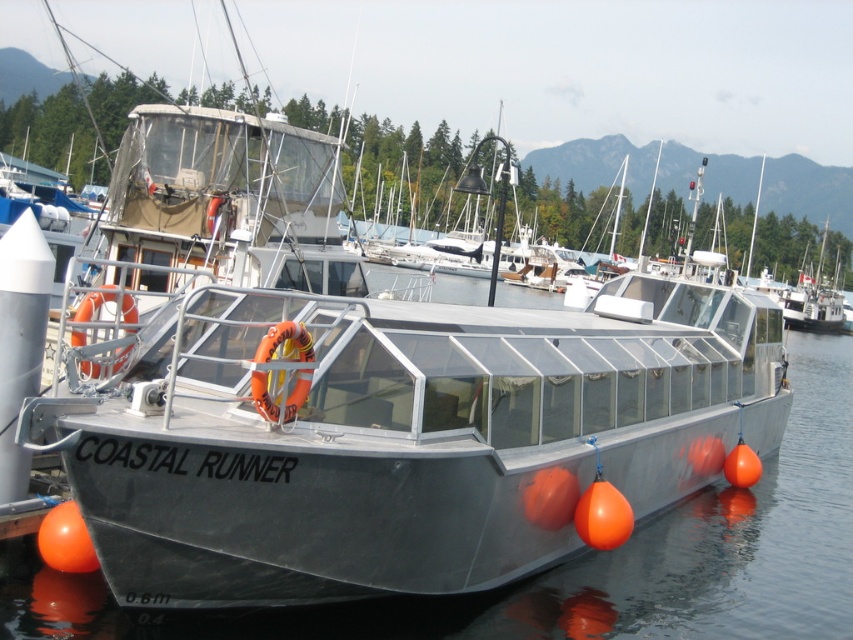
Question: Which point is farther to the camera?

Choices:
 (A) (131, 298)
 (B) (268, 403)

Answer: (A)

Question: Does orange rubber life jacket at center appear on the right side of orange rubber life jacket at left?

Choices:
 (A) yes
 (B) no

Answer: (A)

Question: Can you confirm if orange rubber life jacket at center is positioned to the right of orange rubber life jacket at left?

Choices:
 (A) no
 (B) yes

Answer: (B)

Question: Can you confirm if orange rubber life jacket at center is bigger than orange rubber life jacket at left?

Choices:
 (A) yes
 (B) no

Answer: (B)

Question: Which of the following is the closest to the observer?

Choices:
 (A) orange rubber life jacket at left
 (B) orange rubber life jacket at center

Answer: (B)